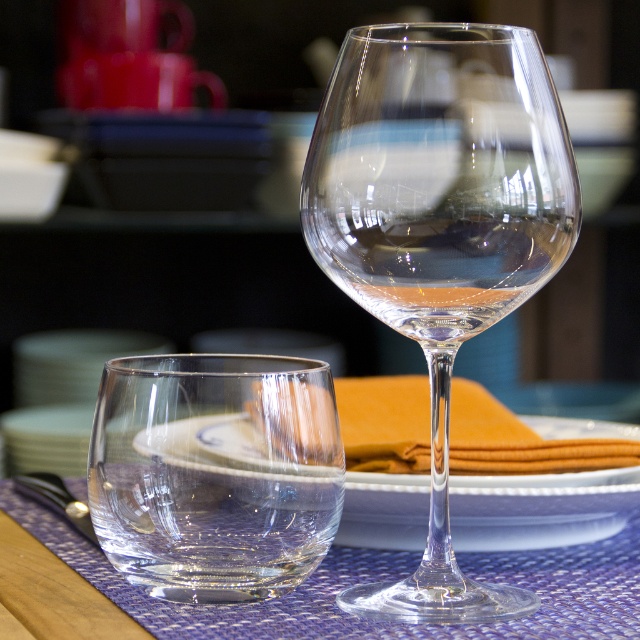
You are setting up a dinner table and need to place a decorative centerpiece between the transparent glass wine at center and the polished silver fork at lower left. If the centerpiece is 7 inches wide, will it fit between them?

The transparent glass wine at center and polished silver fork at lower left are 6.95 inches apart. Since the centerpiece is 7 inches wide, it will not fit between them as the space is slightly narrower.

You are setting the table and need to place a dessert plate between the transparent glass wine at center and the polished silver fork at lower left. Can you fit the dessert plate between them?

The transparent glass wine at center is positioned on the right side of polished silver fork at lower left, so there is space between them to place the dessert plate.